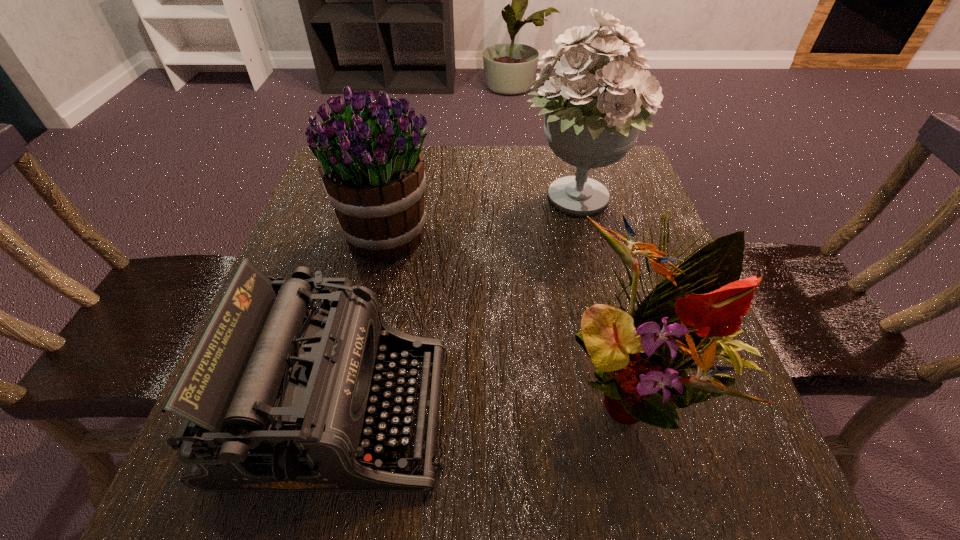
At what (x,y) coordinates should I click in order to perform the action: click on the tallest object. Please return your answer as a coordinate pair (x, y). The height and width of the screenshot is (540, 960). Looking at the image, I should click on pos(591,122).

Where is `the leftmost bouquet`? The width and height of the screenshot is (960, 540). the leftmost bouquet is located at coordinates (372, 168).

Image resolution: width=960 pixels, height=540 pixels. I want to click on the nearest bouquet, so [x=692, y=314].

What are the coordinates of `typewriter` in the screenshot? It's located at coord(277,396).

The width and height of the screenshot is (960, 540). In order to click on free spot located on the left of the tallest bouquet in this screenshot , I will do 489,202.

I want to click on free space located 0.230m on the front of the leftmost bouquet, so click(x=356, y=368).

Locate an element on the screen. The height and width of the screenshot is (540, 960). blank space located 0.360m on the keyboard of the typewriter is located at coordinates (684, 411).

This screenshot has width=960, height=540. Find the location of `object that is at the far edge`. object that is at the far edge is located at coordinates (591, 122).

Identify the location of bouquet present at the near edge. (692, 314).

Image resolution: width=960 pixels, height=540 pixels. I want to click on typewriter that is at the near edge, so click(277, 396).